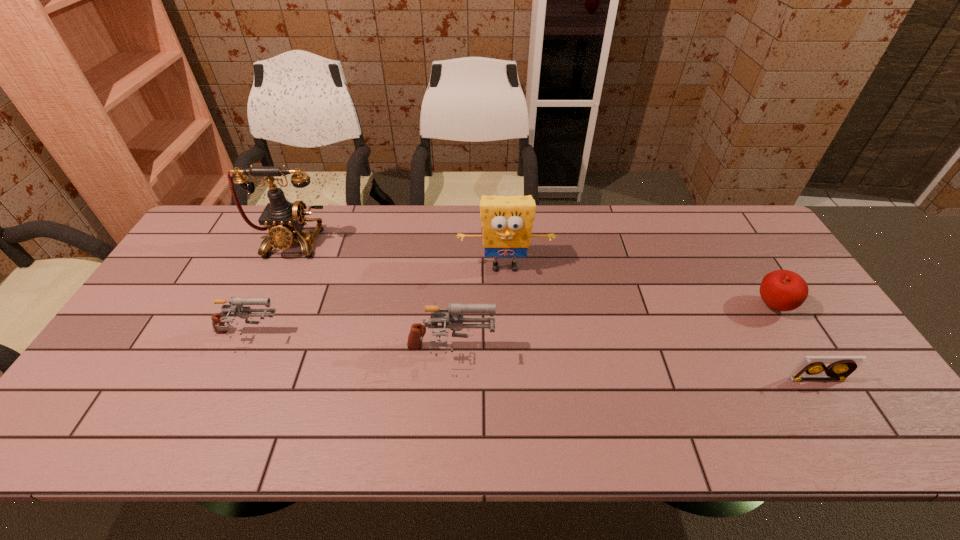
At what (x,y) coordinates should I click in order to perform the action: click on vacant area between the apple and the shorter gun. Please return your answer as a coordinate pair (x, y). Image resolution: width=960 pixels, height=540 pixels. Looking at the image, I should click on (510, 321).

The height and width of the screenshot is (540, 960). Find the location of `free space between the left gun and the apple`. free space between the left gun and the apple is located at coordinates (510, 321).

Identify the location of empty space that is in between the fourth shortest object and the videotape. (634, 366).

The image size is (960, 540). I want to click on free area in between the shortest object and the telephone, so click(x=554, y=310).

The height and width of the screenshot is (540, 960). Find the location of `object that is the second closest to the videotape`. object that is the second closest to the videotape is located at coordinates (507, 221).

Point out which object is positioned as the fourth nearest to the left gun. Please provide its 2D coordinates. Your answer should be formatted as a tuple, i.e. [(x, y)], where the tuple contains the x and y coordinates of a point satisfying the conditions above.

[(813, 367)]

Where is `vacant area in the image that satisfies the following two spatial constraints: 1. on the face of the sponge; 2. on the left side of the apple`? vacant area in the image that satisfies the following two spatial constraints: 1. on the face of the sponge; 2. on the left side of the apple is located at coordinates (507, 306).